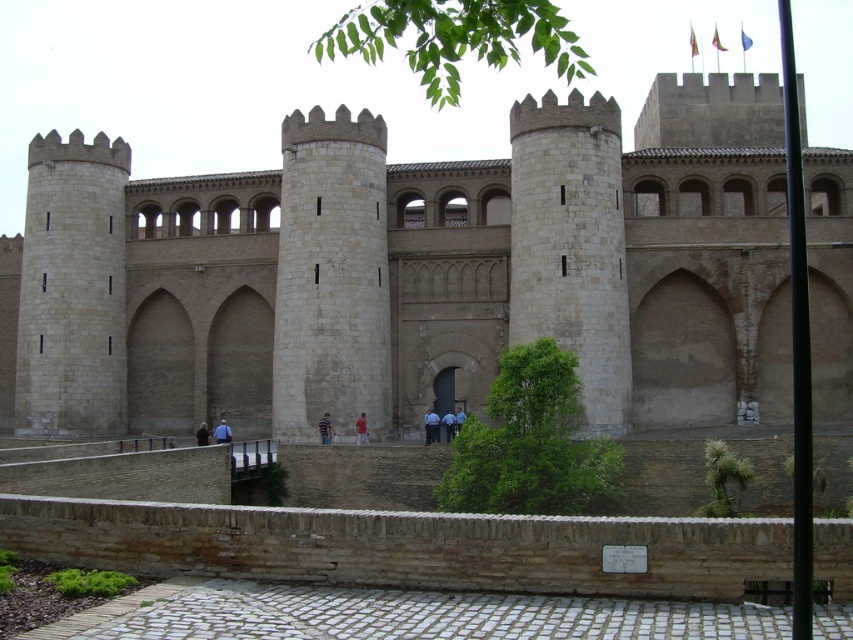
Does point (102, 296) come farther from viewer compared to point (430, 420)?

Yes, it is.

Who is taller, beige stone castle at center or light blue uniform at center?

Standing taller between the two is beige stone castle at center.

Is point (187, 337) positioned before point (425, 436)?

No.

I want to click on beige stone castle at center, so click(410, 273).

Can you confirm if light blue uniform at center is smaller than dark blue shirt at center?

Yes.

Who is shorter, light blue uniform at center or dark blue shirt at center?

With less height is dark blue shirt at center.

Find the location of a particular element. light blue uniform at center is located at coordinates (431, 426).

Locate an element on the screen. light blue uniform at center is located at coordinates (431, 426).

Does light blue uniform at center appear on the left side of blue uniformed person at center?

Yes, light blue uniform at center is to the left of blue uniformed person at center.

Is the position of light blue uniform at center less distant than that of blue uniformed person at center?

Yes, it is.

Identify the location of light blue uniform at center. Image resolution: width=853 pixels, height=640 pixels. (431, 426).